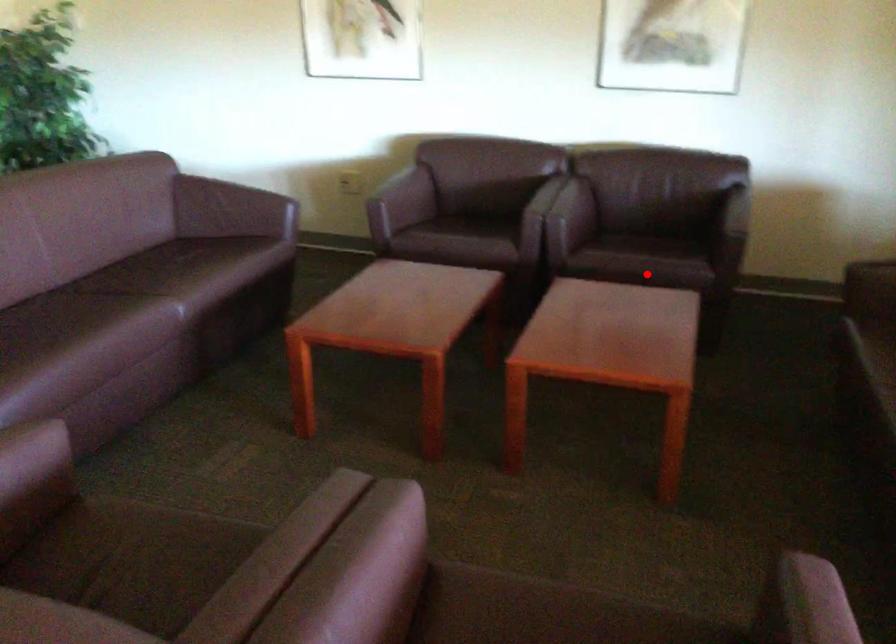
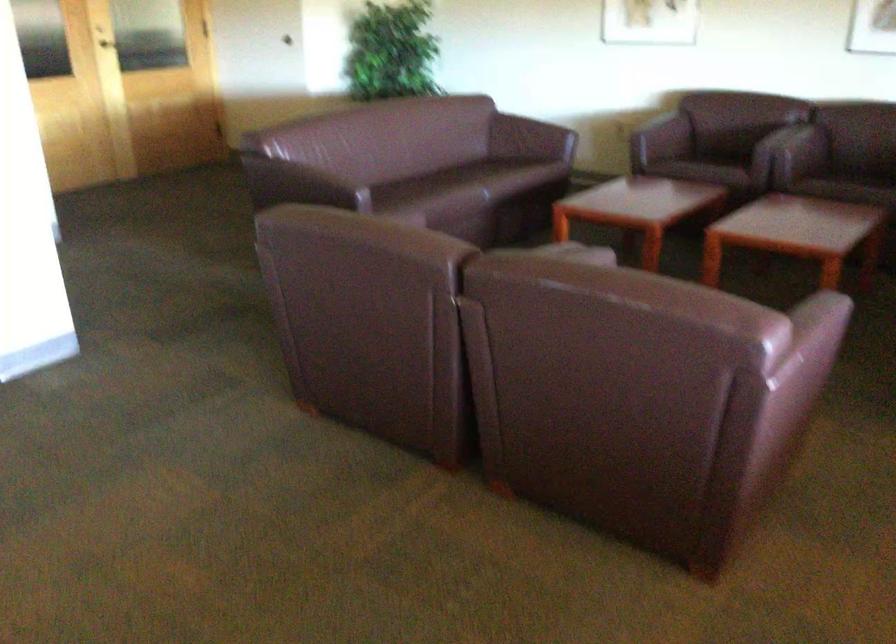
Question: A red point is marked in image1. In image2, is the corresponding 3D point closer to the camera or farther? Reply with the corresponding letter.

Choices:
 (A) The corresponding 3D point is closer.
 (B) The corresponding 3D point is farther.

Answer: (B)